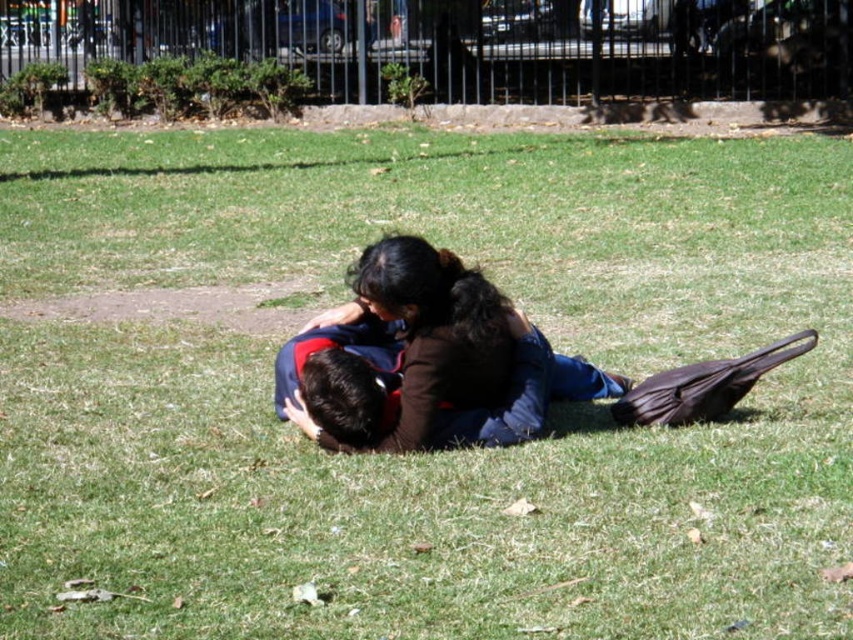
You are standing at a point behind both point (x=299, y=401) and point (x=392, y=374). If you want to walk towards the closer point to you, which point should you head towards?

Point (x=299, y=401) is in front of point (x=392, y=374), so the closer point to you is point (x=299, y=401). You should head towards point (x=299, y=401).

You are standing in a park and see two shirts lying on the grass at the center. The shirts are described as matte blue shirt at center and dark blue fabric shirt at center. Which shirt is positioned to the right when viewed from your perspective?

The matte blue shirt at center is to the right of the dark blue fabric shirt at center.